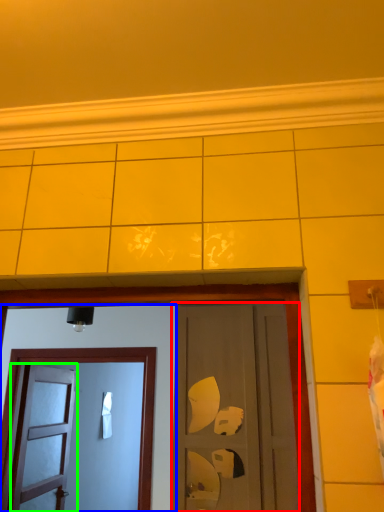
Question: Which is nearer to the door (highlighted by a red box)? door (highlighted by a blue box) or door (highlighted by a green box).

Choices:
 (A) door
 (B) door

Answer: (A)